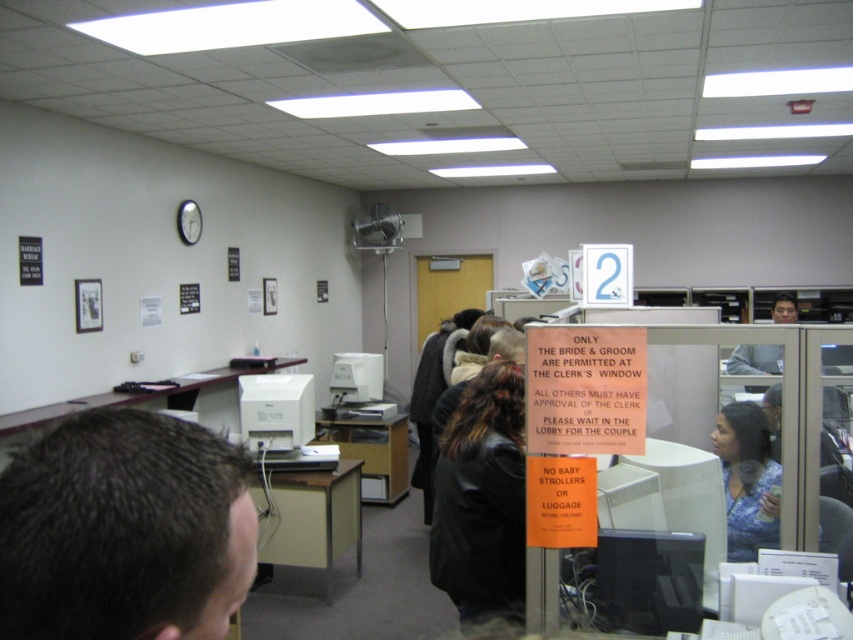
Question: Can you confirm if black leather jacket at center is positioned to the left of blue printed blouse at right?

Choices:
 (A) yes
 (B) no

Answer: (A)

Question: Is black leather jacket at center positioned behind smooth gray shirt at center right?

Choices:
 (A) no
 (B) yes

Answer: (A)

Question: Which object appears farthest from the camera in this image?

Choices:
 (A) smooth gray shirt at center right
 (B) black leather jacket at center
 (C) blue printed blouse at right
 (D) orange paper sign at center

Answer: (A)

Question: Estimate the real-world distances between objects in this image. Which object is closer to the orange paper sign at center?

Choices:
 (A) smooth gray shirt at center right
 (B) dark brown hair at upper left
 (C) black leather jacket at center

Answer: (C)

Question: Which is farther from the smooth gray shirt at center right?

Choices:
 (A) dark brown hair at upper left
 (B) blue printed blouse at right
 (C) orange paper sign at center

Answer: (A)

Question: Is orange paper sign at center smaller than blue printed blouse at right?

Choices:
 (A) no
 (B) yes

Answer: (A)